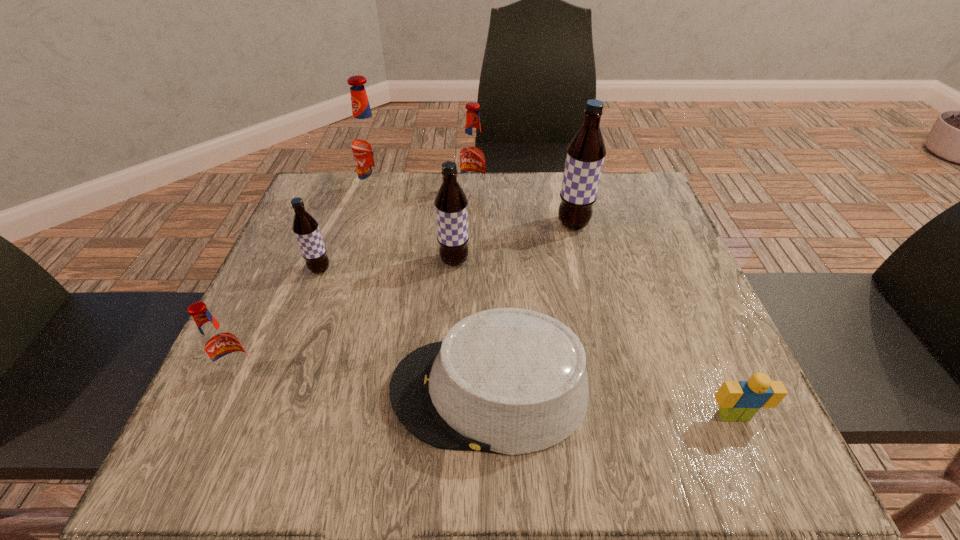
Select which brown root beer is the closest to the second brown root beer from left to right. Please provide its 2D coordinates. Your answer should be formatted as a tuple, i.e. [(x, y)], where the tuple contains the x and y coordinates of a point satisfying the conditions above.

[(586, 152)]